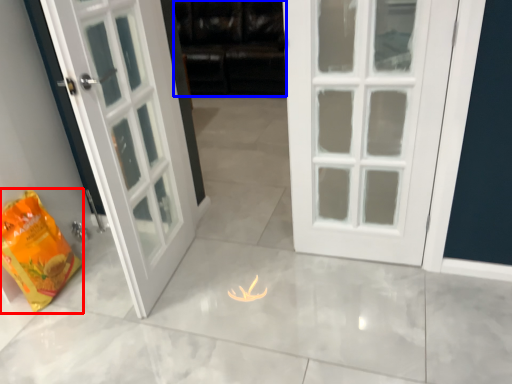
Question: Which point is further to the camera, shopping bag (highlighted by a red box) or dark (highlighted by a blue box)?

Choices:
 (A) shopping bag
 (B) dark

Answer: (B)